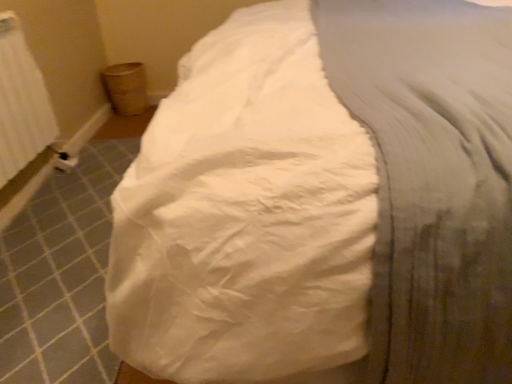
Question: In terms of height, does white cotton sheet at center look taller or shorter compared to white textured radiator at left?

Choices:
 (A) tall
 (B) short

Answer: (A)

Question: Is white cotton sheet at center wider or thinner than white textured radiator at left?

Choices:
 (A) wide
 (B) thin

Answer: (A)

Question: Is white cotton sheet at center inside the boundaries of white textured radiator at left, or outside?

Choices:
 (A) inside
 (B) outside

Answer: (B)

Question: Is white textured radiator at left taller or shorter than white cotton sheet at center?

Choices:
 (A) tall
 (B) short

Answer: (B)

Question: In the image, is white textured radiator at left positioned in front of or behind white cotton sheet at center?

Choices:
 (A) front
 (B) behind

Answer: (B)

Question: From a real-world perspective, is white textured radiator at left positioned above or below white cotton sheet at center?

Choices:
 (A) above
 (B) below

Answer: (A)

Question: Is white textured radiator at left inside the boundaries of white cotton sheet at center, or outside?

Choices:
 (A) inside
 (B) outside

Answer: (B)